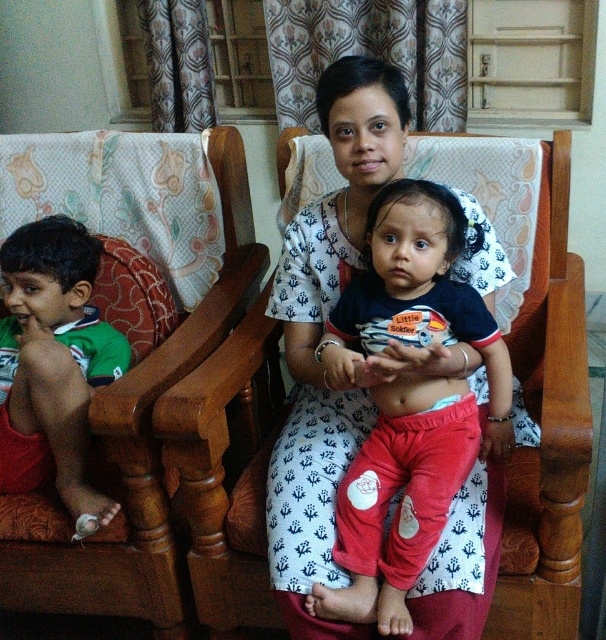
You are a guest in this living room and want to sit down. There is a wooden rocking chair at center and a matte black shirt at center. Which object can you sit on?

The wooden rocking chair at center is larger in size than the matte black shirt at center, so you can sit on the wooden rocking chair at center.

You are arranging furniture in a living room and need to place the wooden rocking chair at center and the matte black shirt at center. Which object requires more horizontal space?

The matte black shirt at center requires more horizontal space because the wooden rocking chair at center has a lesser width compared to matte black shirt at center.

You are organizing a small party in the living room and need to arrange seating for guests. You have a matte black shirt at center and a brown wood rocking chair at left. Which object takes up more space in the living room?

The brown wood rocking chair at left takes up more space than the matte black shirt at center because the matte black shirt at center occupies less space than brown wood rocking chair at left.